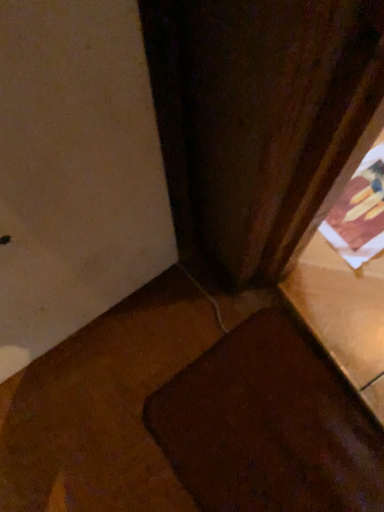
Describe the element at coordinates (268, 426) in the screenshot. This screenshot has width=384, height=512. I see `brown leather mat at lower center` at that location.

Where is `brown leather mat at lower center`? brown leather mat at lower center is located at coordinates 268,426.

Where is `brown leather mat at lower center`? The image size is (384, 512). brown leather mat at lower center is located at coordinates (268, 426).